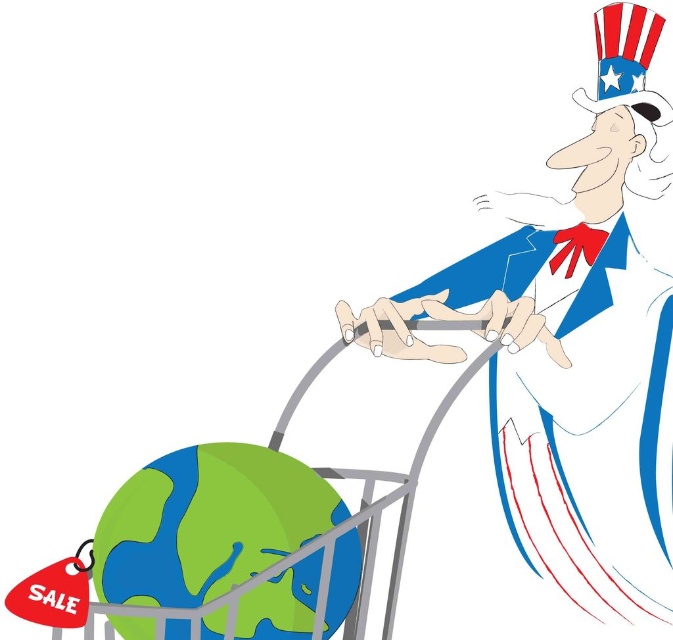
Question: Is white paper man at right positioned before metallic gray trolley at lower left?

Choices:
 (A) no
 (B) yes

Answer: (A)

Question: Which of these objects is positioned farthest from the metallic gray trolley at lower left?

Choices:
 (A) white paper man at right
 (B) green matte globe at lower left

Answer: (A)

Question: In this image, where is green matte globe at lower left located relative to metallic gray trolley at lower left?

Choices:
 (A) above
 (B) below

Answer: (B)

Question: Can you confirm if green matte globe at lower left is wider than metallic gray trolley at lower left?

Choices:
 (A) no
 (B) yes

Answer: (A)

Question: Which is nearer to the green matte globe at lower left?

Choices:
 (A) metallic gray trolley at lower left
 (B) white paper man at right

Answer: (A)

Question: Which object is closer to the camera taking this photo?

Choices:
 (A) green matte globe at lower left
 (B) white paper man at right

Answer: (A)